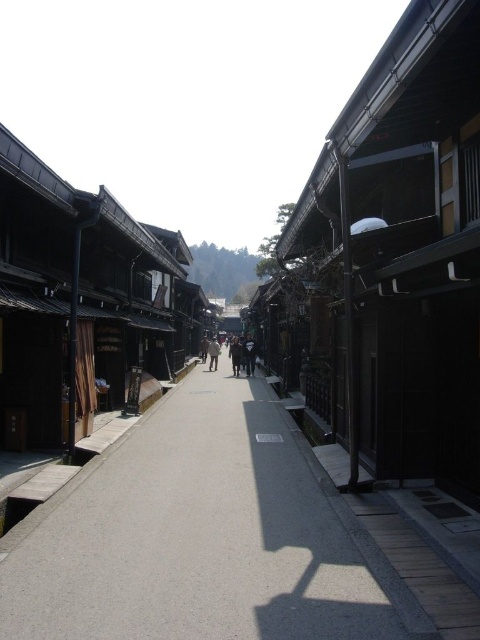
You are a tourist standing on the traditional Japanese street scene. You see two objects at the center of the scene. Which one is taller, the dark blue jeans at center or the light brown wooden person at center?

The dark blue jeans at center is much taller than the light brown wooden person at center according to the description.

You are a tourist walking on the gray concrete pavement at center and you see the light brown wooden person at center. Which object is closer to you as you walk forward?

The gray concrete pavement at center is closer to you because it is in front of the light brown wooden person at center.

You are a delivery person carrying a large package that is 1 meter wide. You need to walk along the gray concrete pavement at center while avoiding the dark gray fabric coat at center. Is there enough space for you to pass safely?

The gray concrete pavement at center might be wider than the dark gray fabric coat at center, so there could be sufficient space for the delivery person to pass safely. However, since the exact width difference isn not specified, caution is advised.